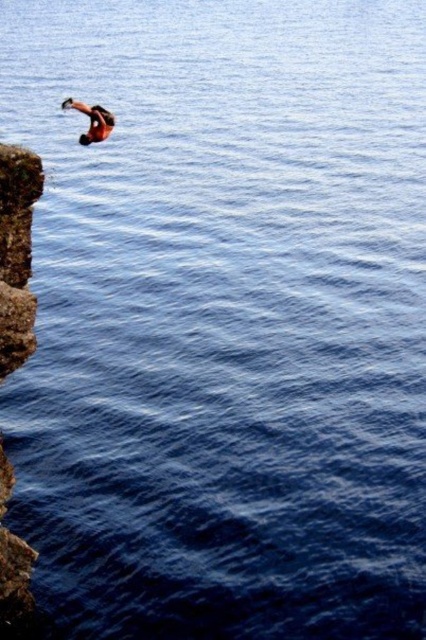
Is point (3, 561) more distant than point (81, 108)?

No, it is in front of (81, 108).

Identify the location of rusty rock at left. The height and width of the screenshot is (640, 426). (17, 253).

Does point (22, 170) come in front of point (66, 106)?

Yes.

Where is `rusty rock at left`? The width and height of the screenshot is (426, 640). rusty rock at left is located at coordinates (17, 253).